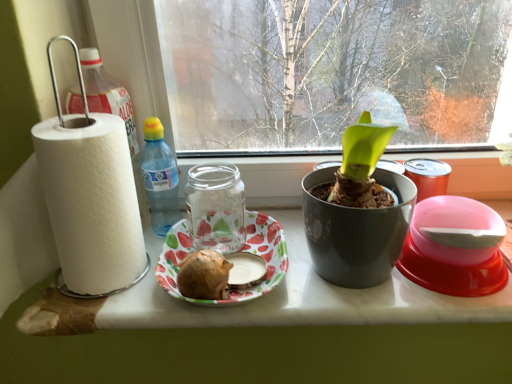
Question: Is the position of strawberry-patterned paper plate at center more distant than that of brown matte potato at center?

Choices:
 (A) yes
 (B) no

Answer: (A)

Question: Is strawberry-patterned paper plate at center at the right side of brown matte potato at center?

Choices:
 (A) yes
 (B) no

Answer: (A)

Question: From the image's perspective, is strawberry-patterned paper plate at center located above brown matte potato at center?

Choices:
 (A) no
 (B) yes

Answer: (B)

Question: Does strawberry-patterned paper plate at center have a greater height compared to brown matte potato at center?

Choices:
 (A) no
 (B) yes

Answer: (A)

Question: Is strawberry-patterned paper plate at center aimed at brown matte potato at center?

Choices:
 (A) no
 (B) yes

Answer: (B)

Question: Would you say strawberry-patterned paper plate at center contains brown matte potato at center?

Choices:
 (A) yes
 (B) no

Answer: (A)

Question: Is white paper towel at left at the right side of strawberry-patterned paper plate at center?

Choices:
 (A) yes
 (B) no

Answer: (A)

Question: From a real-world perspective, is white paper towel at left under strawberry-patterned paper plate at center?

Choices:
 (A) no
 (B) yes

Answer: (B)

Question: Is white paper towel at left completely or partially outside of strawberry-patterned paper plate at center?

Choices:
 (A) yes
 (B) no

Answer: (A)

Question: Does white paper towel at left have a smaller size compared to strawberry-patterned paper plate at center?

Choices:
 (A) no
 (B) yes

Answer: (A)

Question: Could you tell me if white paper towel at left is facing strawberry-patterned paper plate at center?

Choices:
 (A) yes
 (B) no

Answer: (B)

Question: From the image's perspective, does white paper towel at left appear lower than strawberry-patterned paper plate at center?

Choices:
 (A) no
 (B) yes

Answer: (B)

Question: Is transparent glass jar at center outside of white paper at left?

Choices:
 (A) yes
 (B) no

Answer: (A)